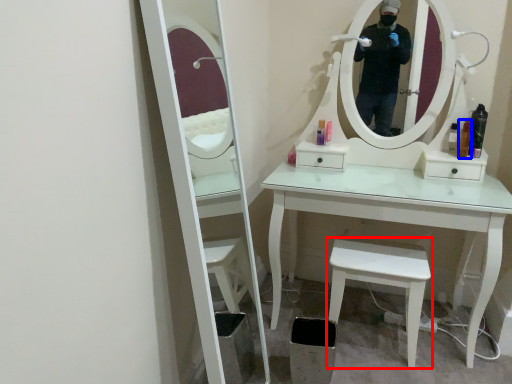
Question: Which object appears farthest to the camera in this image, stool (highlighted by a red box) or toiletry (highlighted by a blue box)?

Choices:
 (A) stool
 (B) toiletry

Answer: (B)